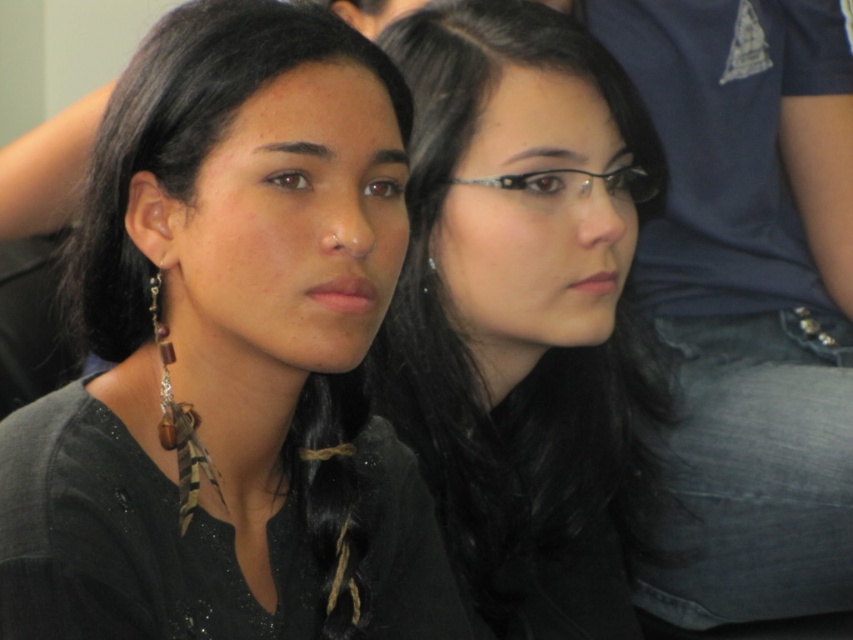
Between black matte hair at center and brown feather earring at center, which one is positioned lower?

black matte hair at center

Is point (480, 209) more distant than point (426, 260)?

That is False.

Where is `black matte hair at center`? This screenshot has height=640, width=853. black matte hair at center is located at coordinates (520, 300).

Who is more distant from viewer, (96, 292) or (467, 180)?

Positioned behind is point (467, 180).

This screenshot has width=853, height=640. I want to click on black matte hair at upper left, so click(x=229, y=353).

Consider the image. Does black matte hair at upper left appear under black matte hair at upper right?

Indeed, black matte hair at upper left is positioned under black matte hair at upper right.

The width and height of the screenshot is (853, 640). Describe the element at coordinates (229, 353) in the screenshot. I see `black matte hair at upper left` at that location.

At what (x,y) coordinates should I click in order to perform the action: click on black matte hair at upper left. Please return your answer as a coordinate pair (x, y). Looking at the image, I should click on (229, 353).